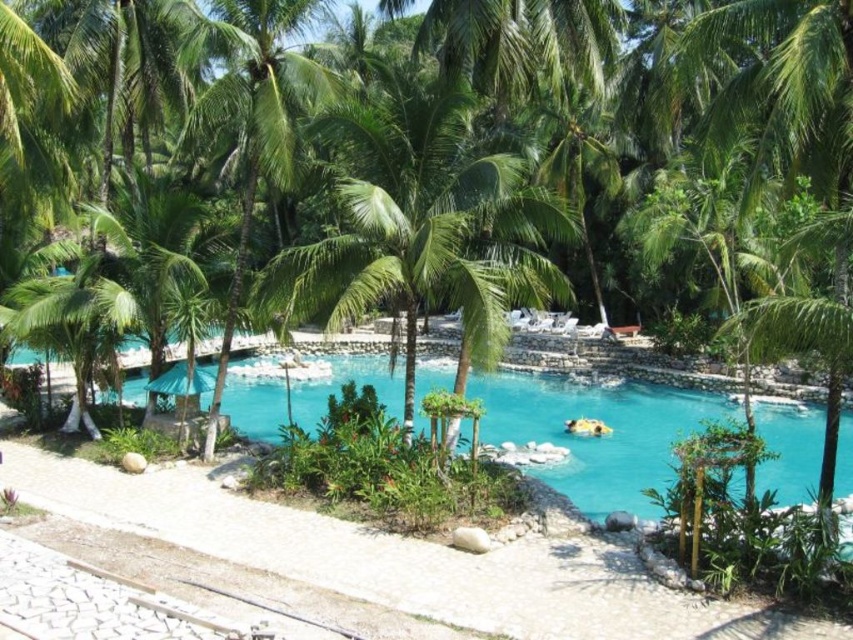
You are planning to install a small garden bench in this tropical setting. The bench requires a space that is not occupied by the green leafy palm tree at center or the turquoise glossy water at center. Based on the scene description, where would be a suitable location for the bench?

A suitable location for the bench would be along the paved pathway made of light colored stones in the foreground, as it is not occupied by the green leafy palm tree at center or the turquoise glossy water at center and provides enough space since the pathway is well maintained and clean.

You are standing at the entrance of the resort and want to walk directly towards the green leafy palm tree at center. According to the coordinates provided, in which direction should you head from your current position?

The green leafy palm tree at center is located at coordinates point (422, 228). Since coordinates typically represent positions on a grid where the origin is at the bottom left corner, moving towards the palm tree would require heading towards the upper middle area of the scene. However, without specific directional markers, the exact path depends on aligning with the tree at those coordinates.

You are standing at the entrance of the resort and want to walk to the pool. There is a green leafy palm tree at center and a turquoise glossy water at center. Which object will you pass under first?

The green leafy palm tree at center is located above the turquoise glossy water at center, so you will pass under the green leafy palm tree at center first before reaching the turquoise glossy water at center.